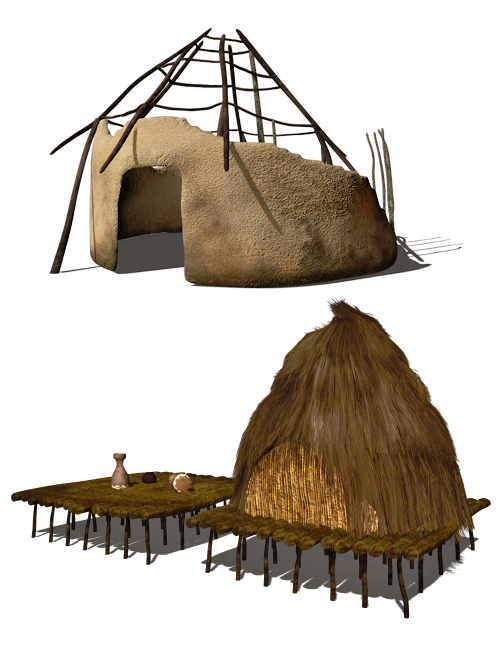
This screenshot has height=650, width=500. In order to click on flooring in this screenshot , I will do `click(220, 511)`.